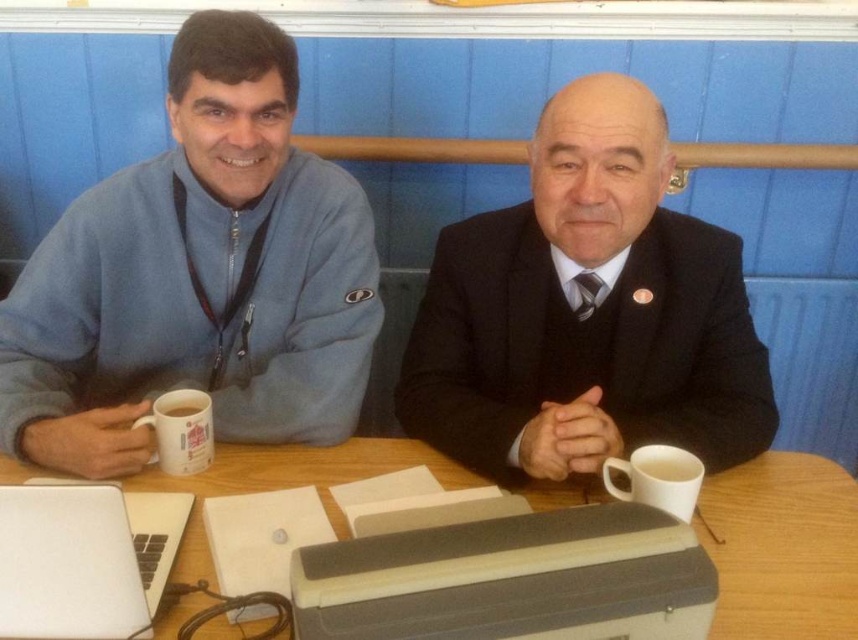
Based on the photo, is white ceramic mug at left thinner than white matte mug at left?

In fact, white ceramic mug at left might be wider than white matte mug at left.

I want to click on white ceramic mug at left, so click(x=180, y=429).

Locate an element on the screen. white ceramic mug at left is located at coordinates (180, 429).

Which is more to the left, gray plastic printer at center or white ceramic mug at left?

white ceramic mug at left is more to the left.

This screenshot has width=858, height=640. What do you see at coordinates (512, 579) in the screenshot?
I see `gray plastic printer at center` at bounding box center [512, 579].

Which is in front, point (591, 600) or point (186, 429)?

Point (591, 600) is in front.

This screenshot has width=858, height=640. Find the location of `gray plastic printer at center`. gray plastic printer at center is located at coordinates (512, 579).

Can you confirm if silver metallic laptop at lower left is bigger than white matte mug at left?

Indeed, silver metallic laptop at lower left has a larger size compared to white matte mug at left.

Which is below, silver metallic laptop at lower left or white matte mug at left?

Positioned lower is silver metallic laptop at lower left.

Is point (17, 576) positioned in front of point (190, 413)?

Yes, it is.

Where is `silver metallic laptop at lower left`? The image size is (858, 640). silver metallic laptop at lower left is located at coordinates (83, 560).